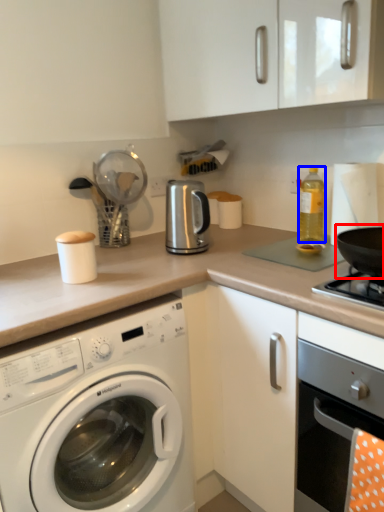
Question: Among these objects, which one is nearest to the camera, wok (highlighted by a red box) or bottle (highlighted by a blue box)?

Choices:
 (A) wok
 (B) bottle

Answer: (A)